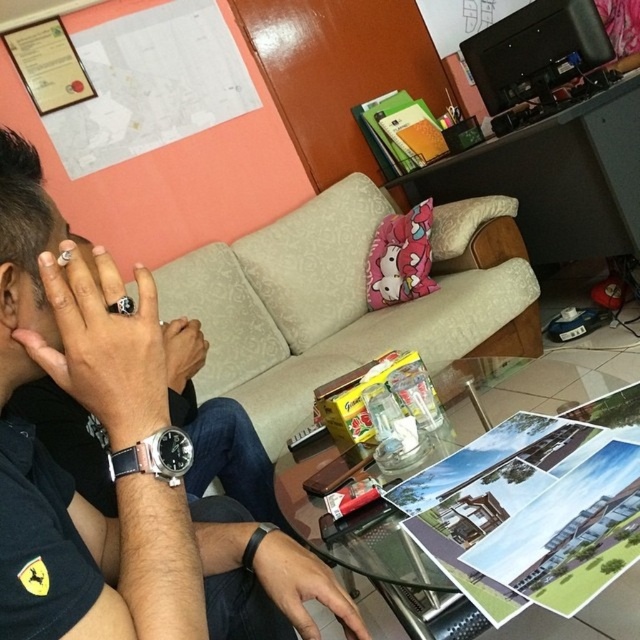
Question: Which point is farther to the camera?

Choices:
 (A) (68, 268)
 (B) (170, 380)
 (C) (134, 426)

Answer: (B)

Question: Is silver metallic ring at center bigger than black leather watch at lower center?

Choices:
 (A) no
 (B) yes

Answer: (B)

Question: Is black leather watch at lower center to the right of black leather watch at lower left from the viewer's perspective?

Choices:
 (A) yes
 (B) no

Answer: (A)

Question: Which object appears farthest from the camera in this image?

Choices:
 (A) black leather watch at lower left
 (B) black leather watch at lower center
 (C) transparent glass table at center

Answer: (C)

Question: Considering the real-world distances, which object is farthest from the black leather watch at center?

Choices:
 (A) transparent glass table at center
 (B) silver metallic ring at center
 (C) black leather ring at center

Answer: (A)

Question: Does transparent glass table at center appear on the left side of silver metallic ring at center?

Choices:
 (A) no
 (B) yes

Answer: (A)